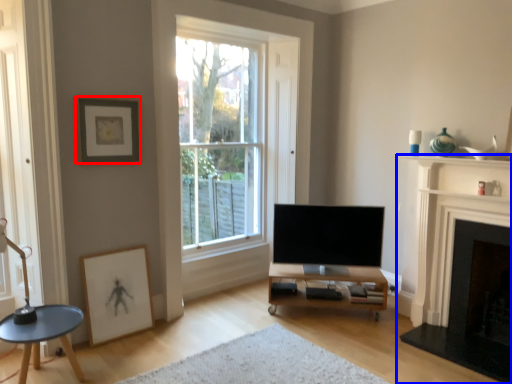
Question: Which object is closer to the camera taking this photo, picture frame (highlighted by a red box) or fireplace (highlighted by a blue box)?

Choices:
 (A) picture frame
 (B) fireplace

Answer: (B)